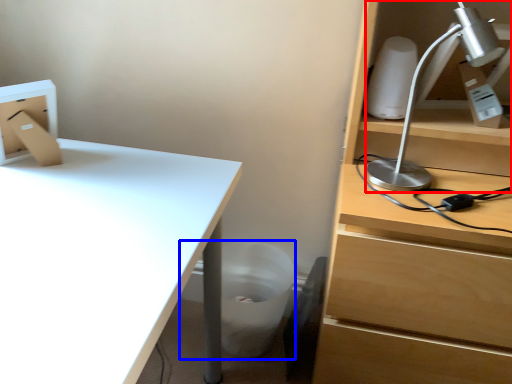
Question: Which point is closer to the camera, lamp (highlighted by a red box) or trash bin/can (highlighted by a blue box)?

Choices:
 (A) lamp
 (B) trash bin/can

Answer: (A)